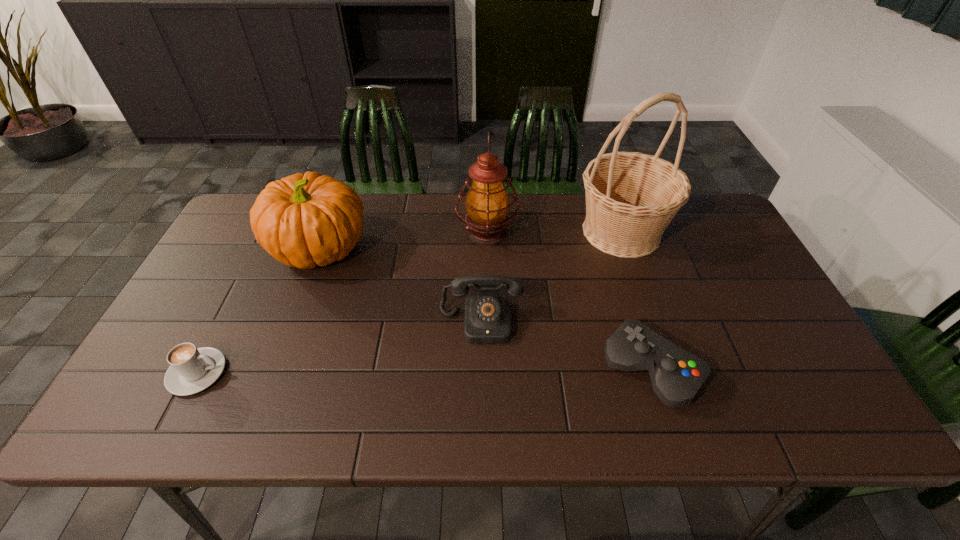
At what (x,y) coordinates should I click in order to perform the action: click on the tallest object. Please return your answer as a coordinate pair (x, y). This screenshot has height=540, width=960. Looking at the image, I should click on (631, 197).

Where is `oil lamp`? oil lamp is located at coordinates (487, 203).

You are a GUI agent. You are given a task and a screenshot of the screen. Output one action in this format:
    pyautogui.click(x=<x>, y=<y>)
    Task: Click on the third tallest object
    The image size is (960, 540).
    Given the screenshot: What is the action you would take?
    pyautogui.click(x=304, y=220)

Locate an element on the screen. Image resolution: width=960 pixels, height=540 pixels. the third shortest object is located at coordinates (487, 314).

I want to click on control, so click(x=676, y=375).

This screenshot has width=960, height=540. In order to click on cappuccino in this screenshot , I will do `click(192, 369)`.

In order to click on vacant space located on the front of the basket in this screenshot , I will do `click(645, 301)`.

The image size is (960, 540). Find the location of `free space located on the left of the oil lamp`. free space located on the left of the oil lamp is located at coordinates (x=408, y=233).

The width and height of the screenshot is (960, 540). What are the coordinates of `vacant space located 0.080m on the surface of the pumpkin` in the screenshot? It's located at (397, 248).

This screenshot has width=960, height=540. I want to click on vacant region located 0.190m on the dial of the telephone, so click(x=481, y=417).